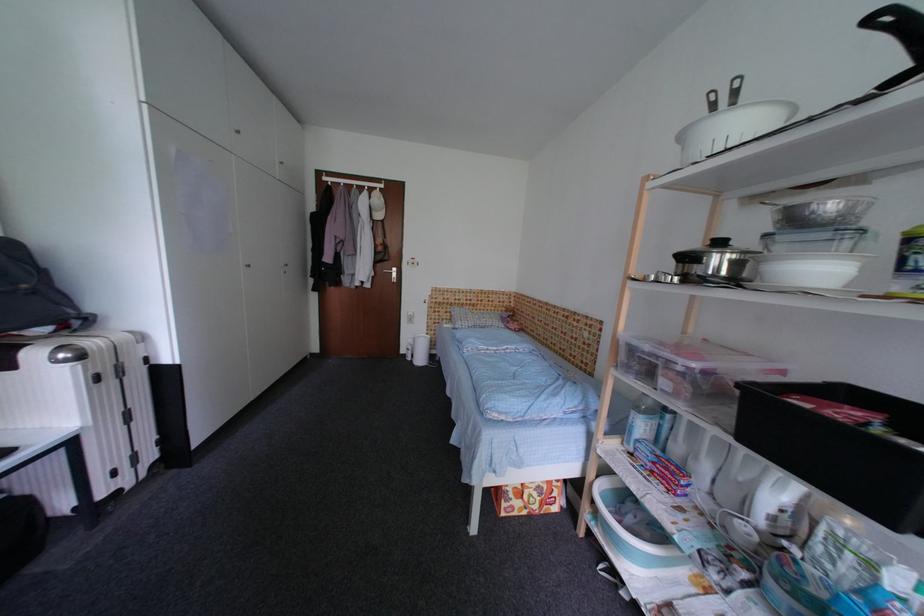
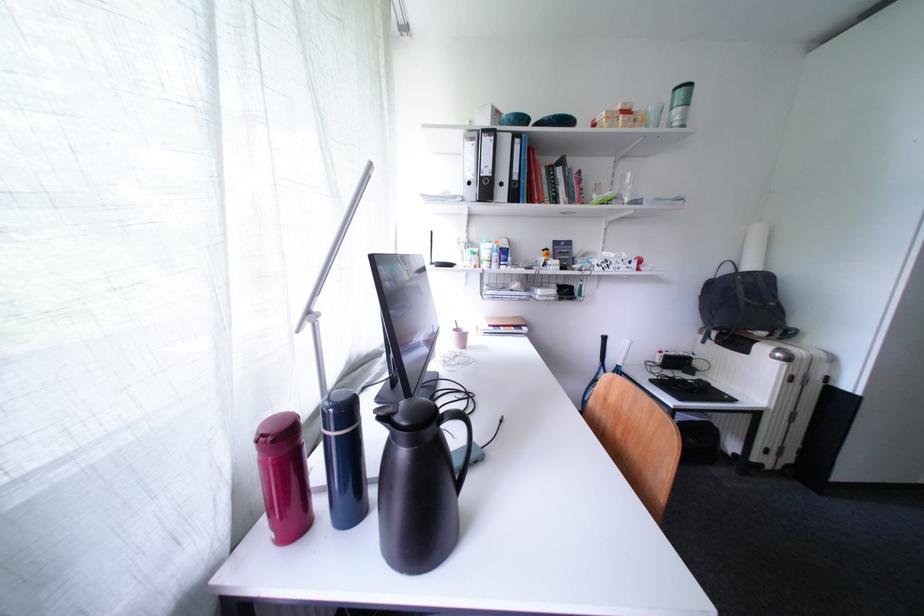
Question: The first image is from the beginning of the video and the second image is from the end. How did the camera likely rotate when shooting the video?

Choices:
 (A) Left
 (B) Right
 (C) Up
 (D) Down

Answer: (A)